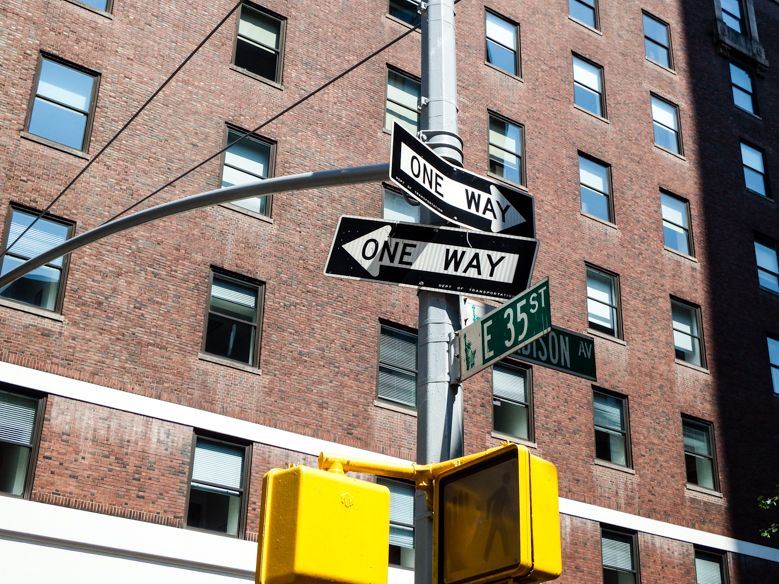
Image resolution: width=779 pixels, height=584 pixels. Identify the location of window. (210, 502).